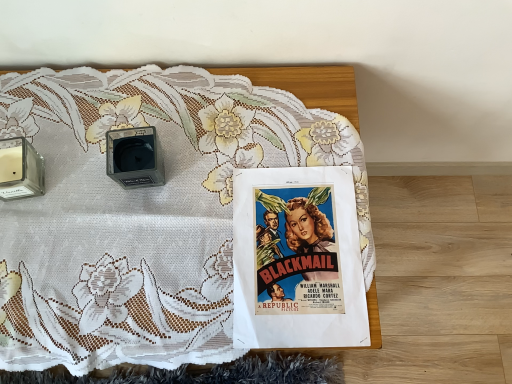
The height and width of the screenshot is (384, 512). Identify the location of vacant area that is situated to the right of transparent glass candle at left, positioned as the 2th speaker in right-to-left order. (99, 173).